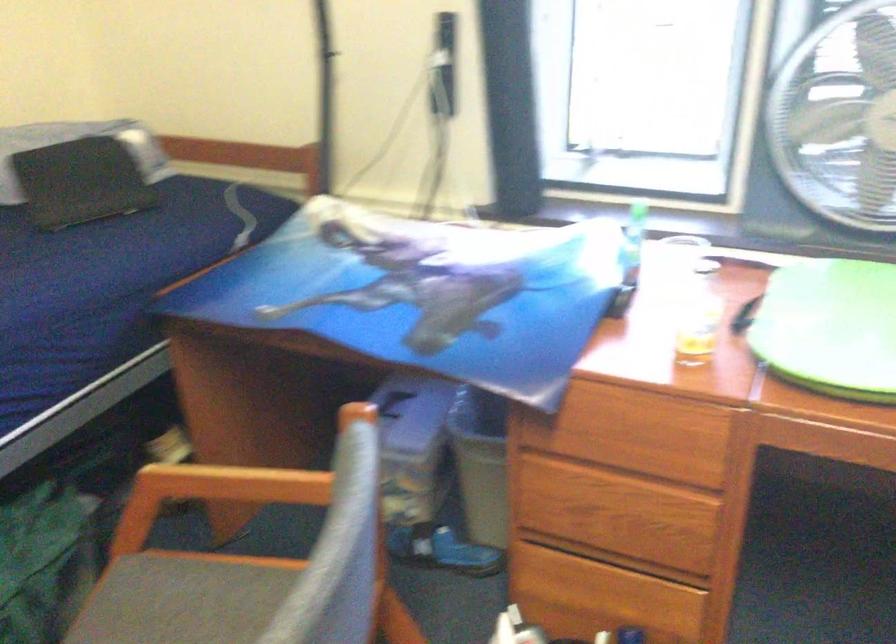
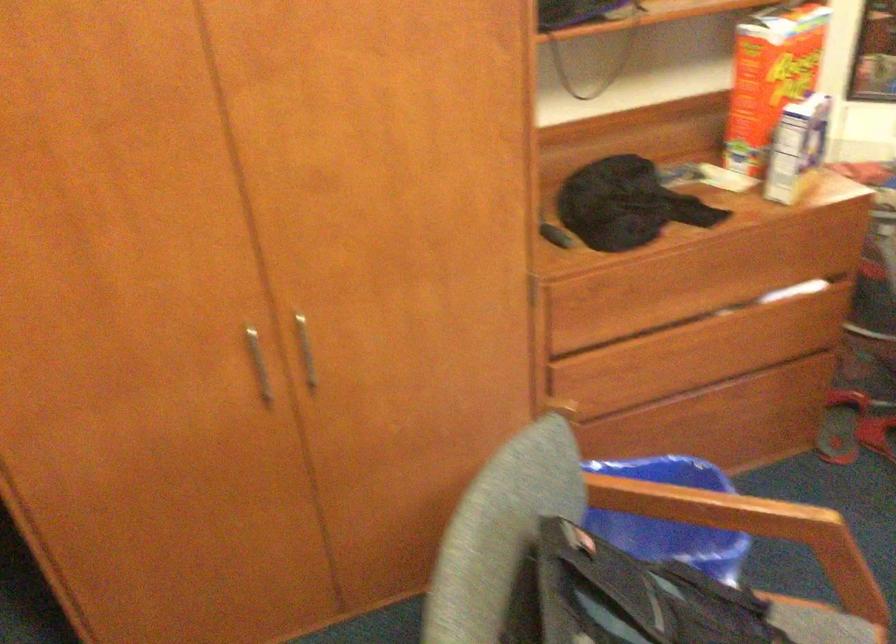
How did the camera likely rotate?

The camera rotated toward left-down.